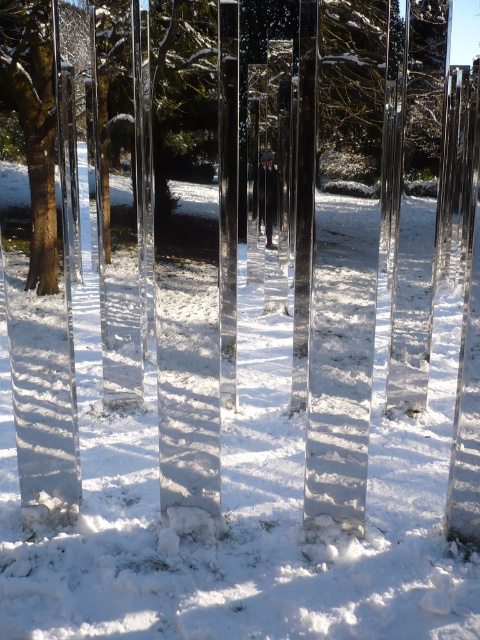
You are standing in the snowy landscape and want to walk towards the brown wood tree at left. Which direction should you move relative to the white glossy snow at center?

You should move to the left of the white glossy snow at center because the brown wood tree at left is positioned on the left side of the white glossy snow at center.

From the picture: You are planning to build a snowman using the white glossy snow at center and the brown wood tree at left. Which object provides more snow material for the snowman?

The brown wood tree at left provides more snow material for the snowman because the white glossy snow at center is thinner than it.

You are standing in the snowy landscape and want to take a photo of both the point at coordinates (88,445) and the point at coordinates (456,42). Which point should you focus on first to ensure both are in clear view?

You should focus on point (88,445) first because it is closer to the camera than point (456,42). By focusing on the closer point, the depth of field may help keep both points in focus.